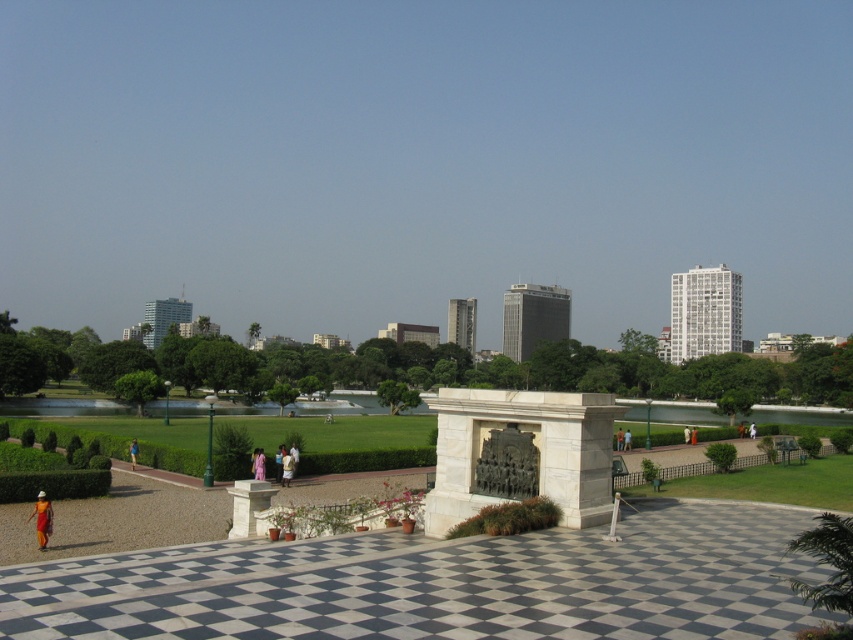
Which is more to the left, white stone column at center or orange fabric dress at lower left?

From the viewer's perspective, orange fabric dress at lower left appears more on the left side.

Can you confirm if white stone column at center is positioned below orange fabric dress at lower left?

No.

Which is in front, point (265, 481) or point (38, 516)?

Point (38, 516) is more forward.

I want to click on white stone column at center, so click(x=248, y=504).

Between point (50, 410) and point (247, 529), which one is positioned in front?

Positioned in front is point (247, 529).

Who is taller, green grass at center or white stone column at center?

Standing taller between the two is green grass at center.

Where is `green grass at center`? This screenshot has width=853, height=640. green grass at center is located at coordinates (62, 406).

Between point (248, 497) and point (288, 461), which one is positioned behind?

Point (288, 461)

Can you confirm if white stone column at center is positioned to the right of white cotton dress at center?

Correct, you'll find white stone column at center to the right of white cotton dress at center.

Does point (247, 483) lie in front of point (283, 456)?

That is True.

Where is `white stone column at center`? The height and width of the screenshot is (640, 853). white stone column at center is located at coordinates (248, 504).